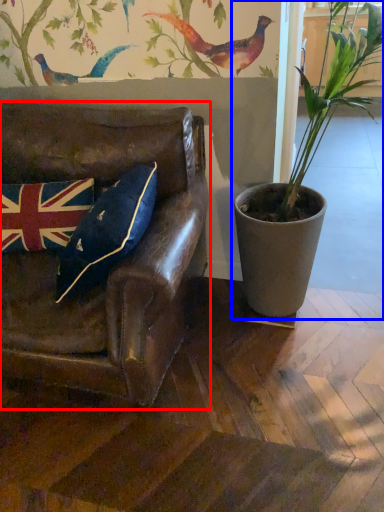
Question: Which of the following is the closest to the observer, chair (highlighted by a red box) or houseplant (highlighted by a blue box)?

Choices:
 (A) chair
 (B) houseplant

Answer: (A)